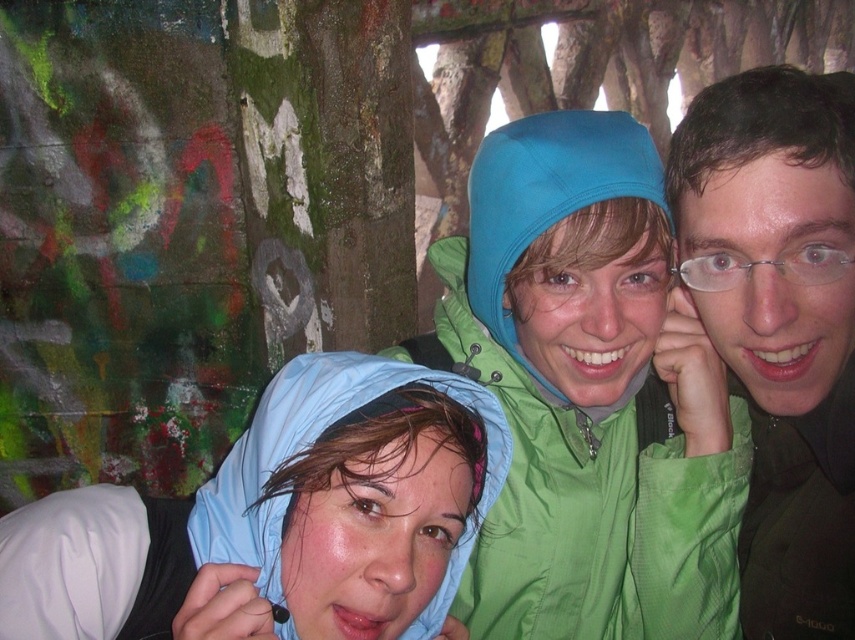
Between blue fabric hood at lower left and green matte jacket at center, which one has less height?

Standing shorter between the two is blue fabric hood at lower left.

Is point (372, 522) positioned before point (700, 593)?

That is True.

You are a GUI agent. You are given a task and a screenshot of the screen. Output one action in this format:
    pyautogui.click(x=<x>, y=<y>)
    Task: Click on the blue fabric hood at lower left
    The height and width of the screenshot is (640, 855).
    Given the screenshot: What is the action you would take?
    pyautogui.click(x=278, y=520)

Who is positioned more to the left, matte green jacket at upper right or green matte jacket at center?

Positioned to the left is green matte jacket at center.

Is point (714, 161) positioned in front of point (550, 528)?

Yes, point (714, 161) is in front of point (550, 528).

Locate an element on the screen. matte green jacket at upper right is located at coordinates (780, 324).

Which of these two, blue fabric hood at lower left or matte green jacket at upper right, stands taller?

Standing taller between the two is matte green jacket at upper right.

Measure the distance from blue fabric hood at lower left to matte green jacket at upper right.

blue fabric hood at lower left is 2.07 meters away from matte green jacket at upper right.

Between point (311, 577) and point (721, 161), which one is positioned behind?

The point (721, 161) is behind.

This screenshot has height=640, width=855. Identify the location of blue fabric hood at lower left. (278, 520).